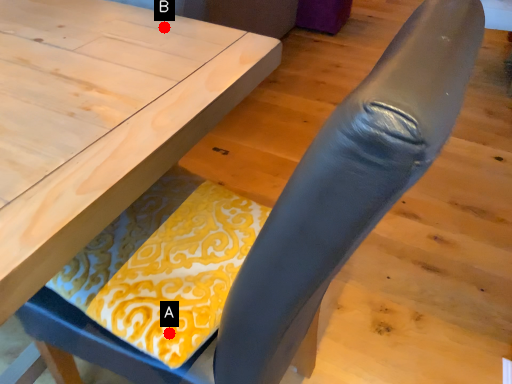
Question: Two points are circled on the image, labeled by A and B beside each circle. Which point appears farthest from the camera in this image?

Choices:
 (A) A is further
 (B) B is further

Answer: (B)